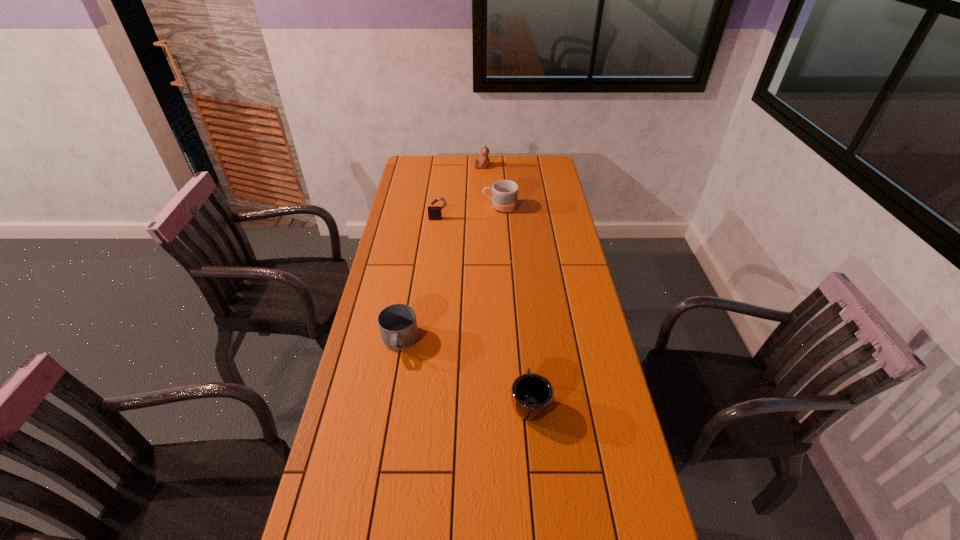
Where is `free spot located on the side with the handle of the second farthest object`? This screenshot has height=540, width=960. free spot located on the side with the handle of the second farthest object is located at coordinates (424, 207).

This screenshot has width=960, height=540. In order to click on vacant space located 0.170m on the side with the handle of the second farthest object in this screenshot , I will do `click(444, 207)`.

Locate an element on the screen. Image resolution: width=960 pixels, height=540 pixels. blank area located with the keyhole on the front of the padlock is located at coordinates (431, 274).

Find the location of `vacant area situated on the side of the second nearest mug with the handle`. vacant area situated on the side of the second nearest mug with the handle is located at coordinates (387, 412).

The width and height of the screenshot is (960, 540). Identify the location of free space located 0.350m on the side of the nearest mug with the handle. [519, 296].

I want to click on blank space located on the side of the nearest mug with the handle, so click(x=520, y=305).

Image resolution: width=960 pixels, height=540 pixels. I want to click on free location located on the side of the nearest mug with the handle, so click(520, 310).

Identify the location of object located in the far edge section of the desktop. (483, 162).

You are a GUI agent. You are given a task and a screenshot of the screen. Output one action in this format:
    pyautogui.click(x=<x>, y=<y>)
    Task: Click on the object present at the left edge
    The width and height of the screenshot is (960, 540).
    Given the screenshot: What is the action you would take?
    pyautogui.click(x=398, y=326)

The image size is (960, 540). In the image, there is a desktop. In order to click on vacant space at the far edge in this screenshot , I will do `click(516, 166)`.